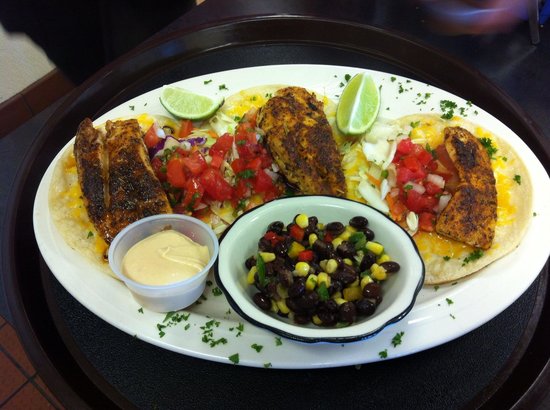
Find the location of `white plate`. white plate is located at coordinates (85, 280).